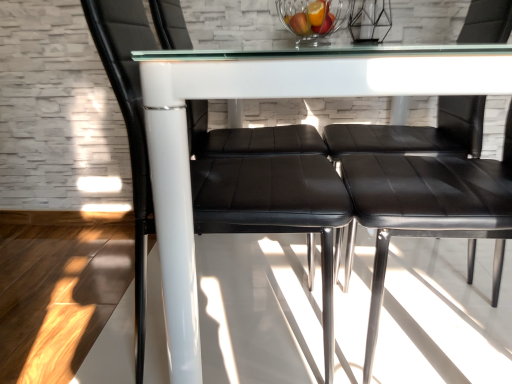
Question: From a real-world perspective, is transparent glass table at center physically located above or below black leather chair at left, which is the second chair in right-to-left order?

Choices:
 (A) above
 (B) below

Answer: (B)

Question: Is transparent glass table at center situated inside black leather chair at left, positioned as the first chair in left-to-right order, or outside?

Choices:
 (A) inside
 (B) outside

Answer: (B)

Question: Which is nearer to the clear glass bowl at upper center?

Choices:
 (A) black leather chair at left, which is the second chair in right-to-left order
 (B) transparent glass table at center
 (C) black leather chair at center, positioned as the second chair in left-to-right order

Answer: (C)

Question: Which of these objects is positioned closest to the transparent glass table at center?

Choices:
 (A) black leather chair at left, positioned as the first chair in left-to-right order
 (B) black leather chair at center, which is the 1th chair from right to left
 (C) clear glass bowl at upper center

Answer: (A)